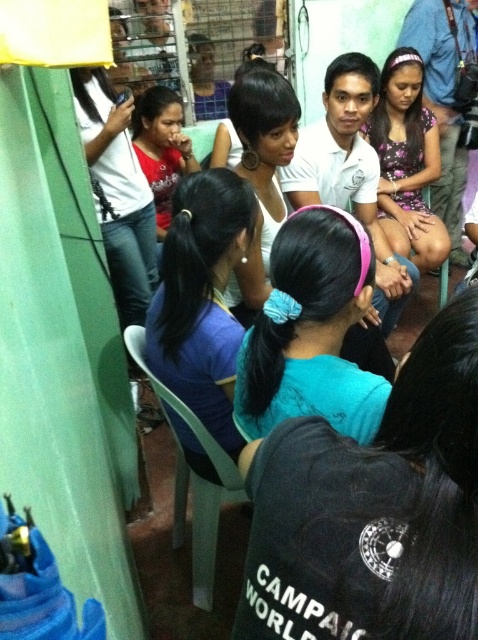
You are organizing a photo shoot and need to ensure that all accessories are visible in the frame. The teal matte headband at center and the blue fabric shirt at center are both important elements. Given their sizes, which of these items might require closer framing to ensure visibility?

The teal matte headband at center is smaller than the blue fabric shirt at center, so the teal matte headband at center might require closer framing to ensure visibility.